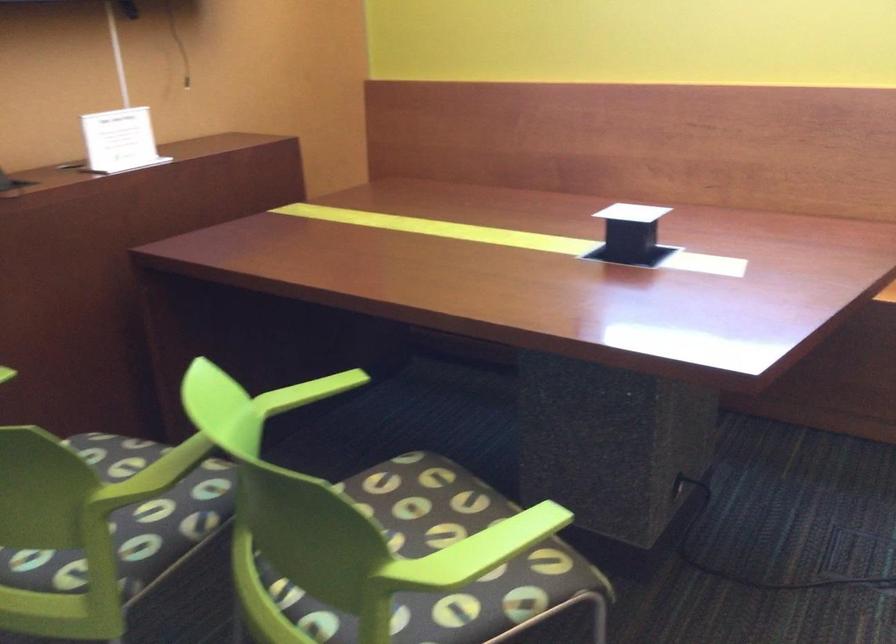
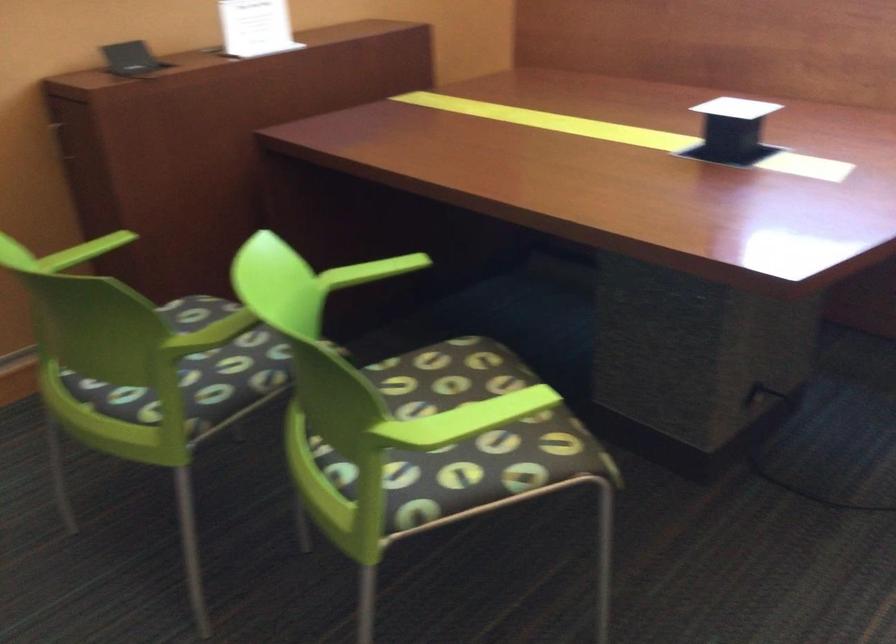
Question: What movement of the cameraman would produce the second image?

Choices:
 (A) Left
 (B) Right
 (C) Forward
 (D) Backward

Answer: (B)